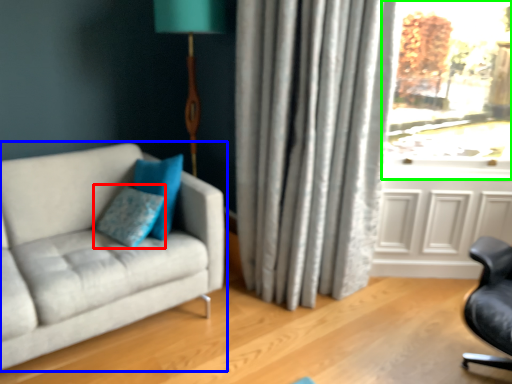
Question: Estimate the real-world distances between objects in this image. Which object is closer to pillow (highlighted by a red box), studio couch (highlighted by a blue box) or window (highlighted by a green box)?

Choices:
 (A) studio couch
 (B) window

Answer: (A)